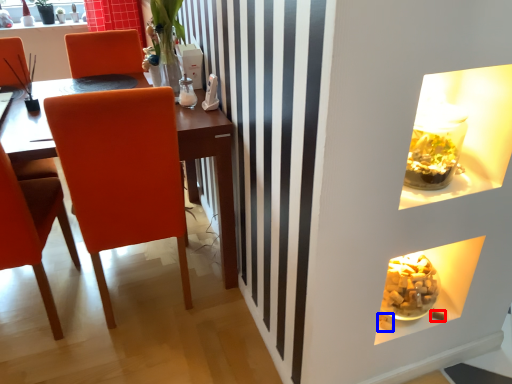
Question: Which of the following is the closest to the observer, food (highlighted by a red box) or food (highlighted by a blue box)?

Choices:
 (A) food
 (B) food

Answer: (B)